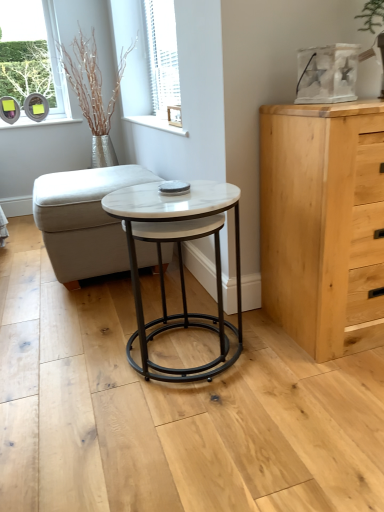
Question: From a real-world perspective, is white textured blinds at upper center above or below white fabric ottoman at center?

Choices:
 (A) below
 (B) above

Answer: (B)

Question: Looking at the image, does white textured blinds at upper center seem bigger or smaller compared to white fabric ottoman at center?

Choices:
 (A) small
 (B) big

Answer: (A)

Question: Based on their relative distances, which object is farther from the white textured blinds at upper center?

Choices:
 (A) light wood chest of drawers at right
 (B) silver metallic vase at upper left
 (C) white fabric ottoman at center
 (D) white marble coffee table at center

Answer: (A)

Question: Which of these objects is positioned closest to the light wood chest of drawers at right?

Choices:
 (A) white marble coffee table at center
 (B) white fabric ottoman at center
 (C) silver metallic vase at upper left
 (D) white textured blinds at upper center

Answer: (A)